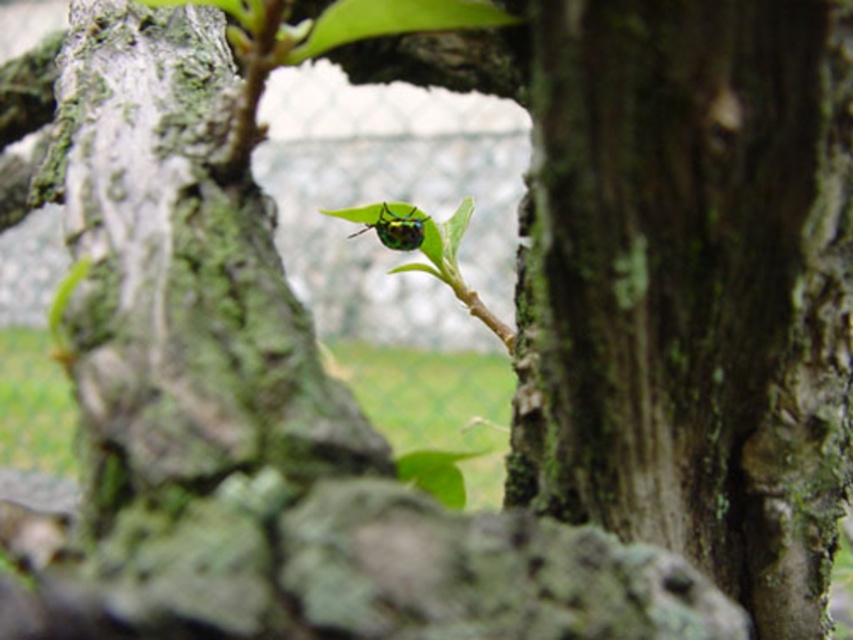
Is green mossy bark at center shorter than metallic green beetle at center?

Incorrect, green mossy bark at center's height does not fall short of metallic green beetle at center's.

Is point (695, 90) positioned after point (387, 230)?

No, it is in front of (387, 230).

Locate an element on the screen. green mossy bark at center is located at coordinates pyautogui.click(x=689, y=285).